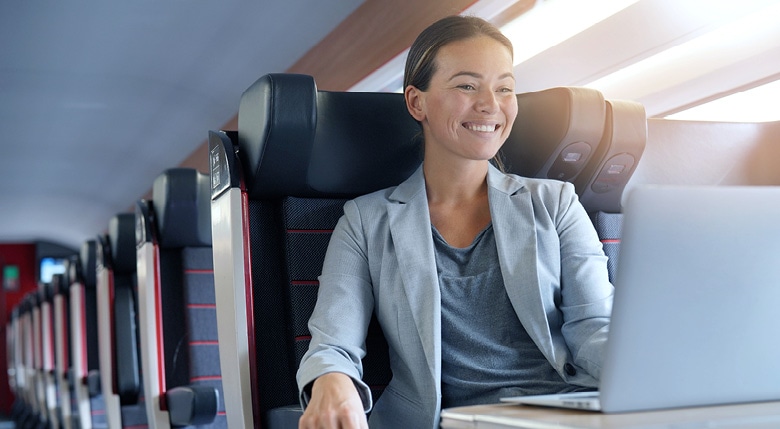
At what (x,y) coordinates should I click in order to perform the action: click on laptop. Please return your answer as a coordinate pair (x, y). The height and width of the screenshot is (429, 780). Looking at the image, I should click on (697, 332).